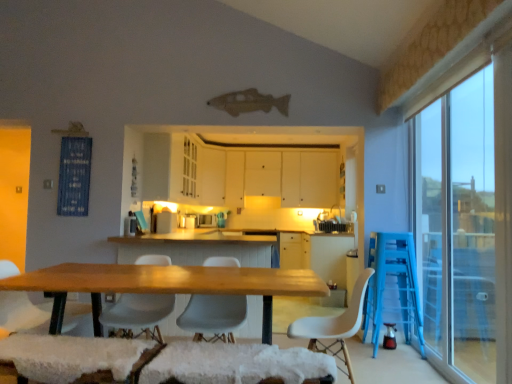
The height and width of the screenshot is (384, 512). Describe the element at coordinates (164, 285) in the screenshot. I see `wooden table at center` at that location.

Measure the distance between white plastic chair at center, arranged as the 1th chair when viewed from the right, and camera.

white plastic chair at center, arranged as the 1th chair when viewed from the right, and camera are 8.90 feet apart from each other.

Describe the element at coordinates (74, 176) in the screenshot. I see `blue fabric at upper left` at that location.

In the scene shown: What is the approximate width of blue fabric at upper left?

It is 1.13 inches.

I want to click on white matte chair at center, which appears as the 3th chair when viewed from the right, so click(137, 315).

Where is `wooden table at center`? This screenshot has width=512, height=384. wooden table at center is located at coordinates (164, 285).

Which object is closer to the camera, white matte chair at center, which appears as the 3th chair when viewed from the right, or white plastic chair at center, arranged as the 1th chair when viewed from the right?

white plastic chair at center, arranged as the 1th chair when viewed from the right, is in front.

From a real-world perspective, which object rests below the other?

From a 3D spatial view, white plastic chair at center, the 4th chair positioned from the left, is below.

How many degrees apart are the facing directions of white matte chair at center, which appears as the 3th chair when viewed from the right, and white plastic chair at center, the 4th chair positioned from the left?

They differ by 89.5 degrees in their facing directions.

Is white matte chair at center, which appears as the 3th chair when viewed from the right, aimed at white plastic chair at center, arranged as the 1th chair when viewed from the right?

No, white matte chair at center, which appears as the 3th chair when viewed from the right, is not oriented towards white plastic chair at center, arranged as the 1th chair when viewed from the right.

Looking at this image, is white matte cabinets at center, the first cabinetry from the front, touching white plastic chair at center, arranged as the third chair when viewed from the left?

No, white matte cabinets at center, the first cabinetry from the front, is not next to white plastic chair at center, arranged as the third chair when viewed from the left.

From the white matte cabinets at center, the first cabinetry from the front, count 2nd chairs forward and point to it. Please provide its 2D coordinates.

[(213, 316)]

Do you think white matte cabinets at center, the first cabinetry from the front, is within white plastic chair at center, acting as the second chair starting from the right, or outside of it?

white matte cabinets at center, the first cabinetry from the front, is not inside white plastic chair at center, acting as the second chair starting from the right, it's outside.

How many degrees apart are the facing directions of white matte cabinets at center, the first cabinetry from the front, and white plastic chair at center, arranged as the third chair when viewed from the left?

There is a 88.8-degree angle between the facing directions of white matte cabinets at center, the first cabinetry from the front, and white plastic chair at center, arranged as the third chair when viewed from the left.

Which object is thinner, white fabric chair at lower left, arranged as the fourth chair when viewed from the right, or transparent glass window at right?

With smaller width is transparent glass window at right.

Is white fabric chair at lower left, placed as the 1th chair when sorted from left to right, inside or outside of transparent glass window at right?

white fabric chair at lower left, placed as the 1th chair when sorted from left to right, is not enclosed by transparent glass window at right.

Is there a large distance between white fabric chair at lower left, placed as the 1th chair when sorted from left to right, and transparent glass window at right?

Indeed, white fabric chair at lower left, placed as the 1th chair when sorted from left to right, is not near transparent glass window at right.

From a real-world perspective, is white fabric chair at lower left, placed as the 1th chair when sorted from left to right, physically below transparent glass window at right?

Yes.

Is wooden table at center taller than white fabric chair at lower left, arranged as the fourth chair when viewed from the right?

No.

Considering the points (276, 274) and (36, 317), which point is in front, point (276, 274) or point (36, 317)?

Point (276, 274)

Consider the image. Is wooden table at center at the right side of white fabric chair at lower left, placed as the 1th chair when sorted from left to right?

Yes, wooden table at center is to the right of white fabric chair at lower left, placed as the 1th chair when sorted from left to right.

Considering their positions, is wooden table at center located in front of or behind white fabric chair at lower left, arranged as the fourth chair when viewed from the right?

wooden table at center is positioned closer to the viewer than white fabric chair at lower left, arranged as the fourth chair when viewed from the right.

Locate an element on the screen. chair that is the 2nd one when counting downward from the white matte chair at center, which appears as the second chair when viewed from the left (from the image's perspective) is located at coordinates (335, 325).

Between white plastic chair at center, arranged as the 1th chair when viewed from the right, and white matte chair at center, which appears as the 3th chair when viewed from the right, which one has larger width?

With larger width is white plastic chair at center, arranged as the 1th chair when viewed from the right.

Is there a large distance between white plastic chair at center, arranged as the 1th chair when viewed from the right, and white matte chair at center, which appears as the 3th chair when viewed from the right?

Indeed, white plastic chair at center, arranged as the 1th chair when viewed from the right, is not near white matte chair at center, which appears as the 3th chair when viewed from the right.

How different are the orientations of white plastic chair at center, the 4th chair positioned from the left, and white matte chair at center, which appears as the second chair when viewed from the left, in degrees?

The angle between the facing direction of white plastic chair at center, the 4th chair positioned from the left, and the facing direction of white matte chair at center, which appears as the second chair when viewed from the left, is 89.5 degrees.

Consider the image. From the image's perspective, between white matte chair at center, which appears as the second chair when viewed from the left, and blue fabric at upper left, which one is located above?

blue fabric at upper left is shown above in the image.

In terms of size, does white matte chair at center, which appears as the second chair when viewed from the left, appear bigger or smaller than blue fabric at upper left?

white matte chair at center, which appears as the second chair when viewed from the left, is bigger than blue fabric at upper left.

Considering the sizes of objects white matte chair at center, which appears as the 3th chair when viewed from the right, and blue fabric at upper left in the image provided, who is thinner, white matte chair at center, which appears as the 3th chair when viewed from the right, or blue fabric at upper left?

With smaller width is blue fabric at upper left.

Is point (106, 325) positioned after point (81, 154)?

No.

From the image's perspective, which one is positioned higher, transparent glass window at right or white matte cabinet at center, the first cabinetry when ordered from back to front?

white matte cabinet at center, the first cabinetry when ordered from back to front, appears higher in the image.

Is transparent glass window at right located outside white matte cabinet at center, the first cabinetry when ordered from back to front?

Yes, transparent glass window at right is not within white matte cabinet at center, the first cabinetry when ordered from back to front.

From a real-world perspective, which cabinetry is the 2nd one above the transparent glass window at right? Please provide its 2D coordinates.

[(211, 176)]

Which is more to the left, transparent glass window at right or white matte cabinet at center, placed as the second cabinetry when sorted from front to back?

white matte cabinet at center, placed as the second cabinetry when sorted from front to back, is more to the left.

Find the location of a particular element. the 3rd chair in front of the white matte chair at center, which appears as the second chair when viewed from the left is located at coordinates (335, 325).

Find the location of `cabinetry on the right of white plastic chair at center, acting as the second chair starting from the right`. cabinetry on the right of white plastic chair at center, acting as the second chair starting from the right is located at coordinates (236, 173).

From the image, which object appears to be farther from blue fabric at upper left, white fabric chair at lower left, placed as the 1th chair when sorted from left to right, or blue plastic bar stool at right?

blue plastic bar stool at right lies further to blue fabric at upper left than the other object.

Estimate the real-world distances between objects in this image. Which object is closer to white plastic chair at center, the 4th chair positioned from the left, white matte cabinet at center, placed as the second cabinetry when sorted from front to back, or blue plastic bar stool at right?

blue plastic bar stool at right.

From the image, which object appears to be nearer to white matte cabinets at center, which is counted as the second cabinetry, starting from the back, white matte cabinet at center, the first cabinetry when ordered from back to front, or white plastic chair at center, arranged as the 1th chair when viewed from the right?

Based on the image, white matte cabinet at center, the first cabinetry when ordered from back to front, appears to be nearer to white matte cabinets at center, which is counted as the second cabinetry, starting from the back.

When comparing their distances from white plastic chair at center, the 4th chair positioned from the left, does blue plastic bar stool at right or transparent glass window at right seem closer?

Among the two, blue plastic bar stool at right is located nearer to white plastic chair at center, the 4th chair positioned from the left.

Which object lies nearer to the anchor point transparent glass window at right, blue fabric at upper left or blue plastic bar stool at right?

blue plastic bar stool at right is positioned closer to the anchor transparent glass window at right.

Looking at the image, which one is located further to white plastic chair at center, the 4th chair positioned from the left, blue fabric at upper left or white plastic chair at center, arranged as the third chair when viewed from the left?

blue fabric at upper left is further to white plastic chair at center, the 4th chair positioned from the left.

Looking at the image, which one is located closer to white matte cabinet at center, the first cabinetry when ordered from back to front, white matte cabinets at center, the first cabinetry from the front, or blue plastic bar stool at right?

Based on the image, white matte cabinets at center, the first cabinetry from the front, appears to be nearer to white matte cabinet at center, the first cabinetry when ordered from back to front.

Looking at the image, which one is located closer to blue plastic bar stool at right, wooden table at center or transparent glass window at right?

Among the two, transparent glass window at right is located nearer to blue plastic bar stool at right.

Image resolution: width=512 pixels, height=384 pixels. What are the coordinates of `window screen located between blue plastic bar stool at right and white matte cabinet at center, placed as the second cabinetry when sorted from front to back, in the depth direction` in the screenshot? It's located at (74, 176).

I want to click on table between white matte chair at center, which appears as the second chair when viewed from the left, and transparent glass window at right, so click(x=164, y=285).

At what (x,y) coordinates should I click in order to perform the action: click on table between white fabric chair at lower left, arranged as the fourth chair when viewed from the right, and blue plastic bar stool at right from left to right. Please return your answer as a coordinate pair (x, y). Looking at the image, I should click on (164, 285).

Identify the location of chair between white plastic chair at center, arranged as the third chair when viewed from the left, and transparent glass window at right. The height and width of the screenshot is (384, 512). (335, 325).